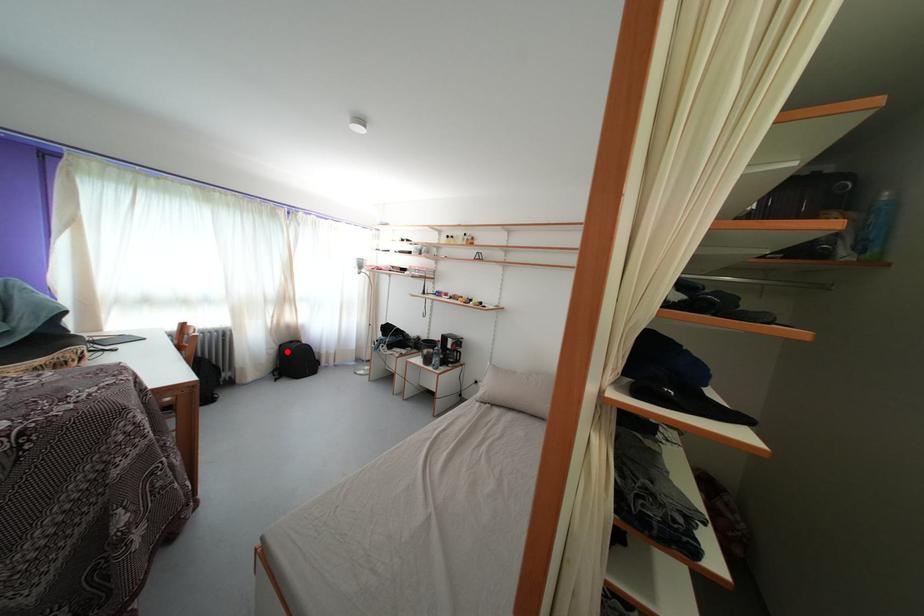
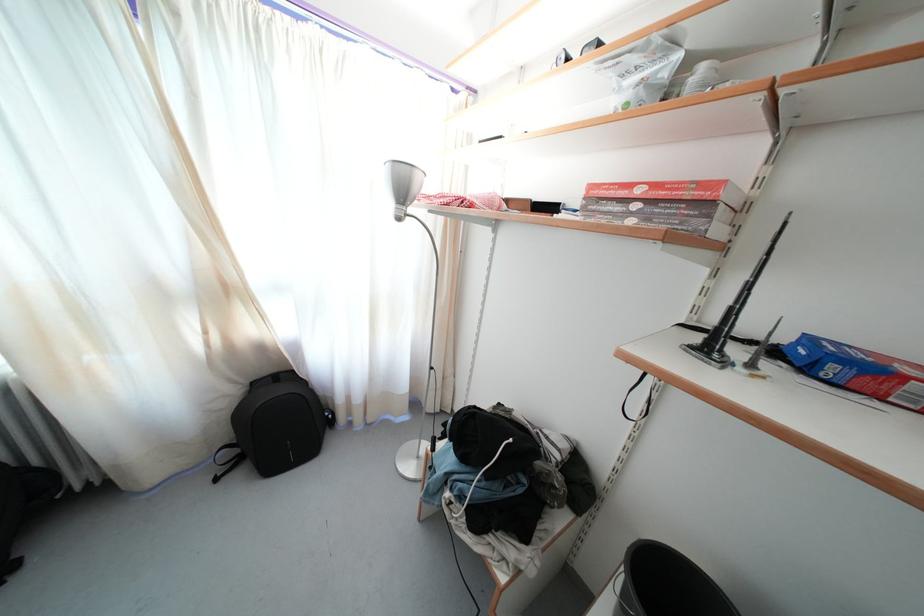
Locate, in the second image, the point that corresponds to the highlighted location in the first image.

(259, 390)